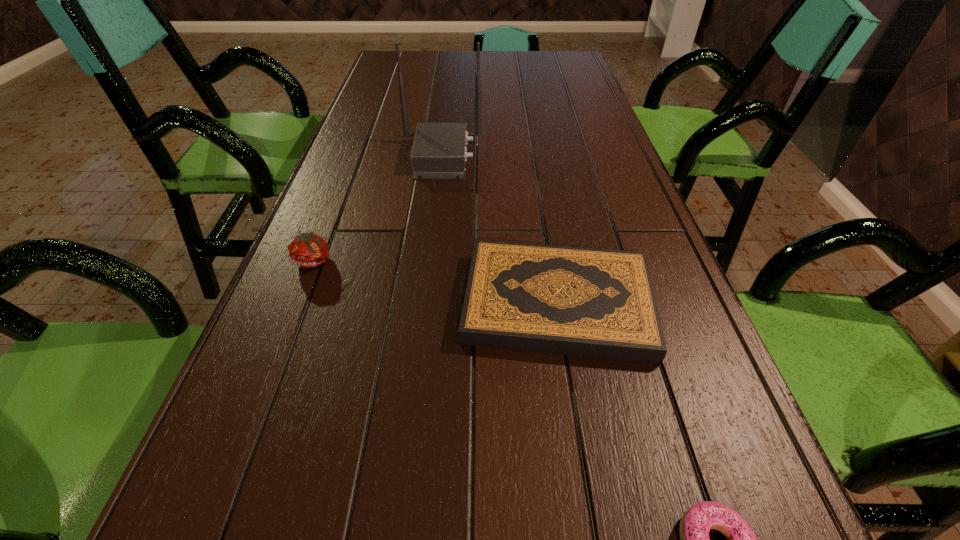
Where is `free point at the far edge`? Image resolution: width=960 pixels, height=540 pixels. free point at the far edge is located at coordinates (472, 65).

This screenshot has width=960, height=540. I want to click on blank area at the left edge, so click(327, 261).

In the image, there is a desktop. At what (x,y) coordinates should I click in order to perform the action: click on vacant area at the right edge. Please return your answer as a coordinate pair (x, y). This screenshot has height=540, width=960. Looking at the image, I should click on (647, 384).

The width and height of the screenshot is (960, 540). I want to click on free spot between the hardback book and the leftmost object, so click(436, 282).

Where is `vacant space that's between the farthest object and the hardback book`? This screenshot has width=960, height=540. vacant space that's between the farthest object and the hardback book is located at coordinates (499, 230).

Locate an element on the screen. The image size is (960, 540). vacant space in between the leftmost object and the tallest object is located at coordinates (378, 208).

Identify the location of unoccupied area between the router and the hardback book. The image size is (960, 540). (499, 230).

Find the location of a particular element. vacant area between the hardback book and the router is located at coordinates (499, 230).

You are a GUI agent. You are given a task and a screenshot of the screen. Output one action in this format:
    pyautogui.click(x=<x>, y=<y>)
    Task: Click on the free spot between the hardback book and the farthest object
    
    Given the screenshot: What is the action you would take?
    pyautogui.click(x=499, y=230)

Locate an element on the screen. object that can be found as the closest to the doughnut is located at coordinates (599, 303).